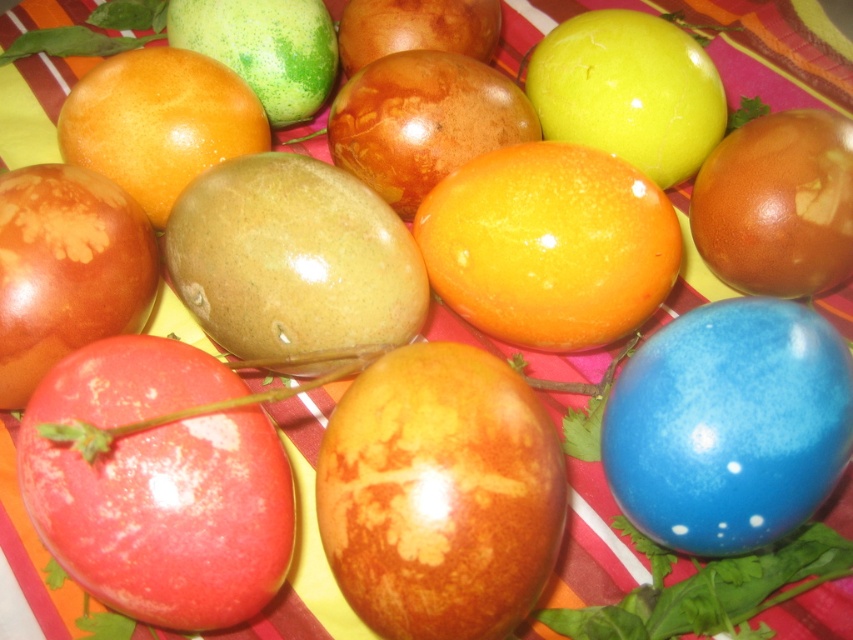
You are arranging a centerpiece for a party and need to place the brown marbled egg at center and the blue glossy egg at lower right. Based on their positions, which egg would be more visible to guests sitting at the table?

The brown marbled egg at center would be more visible to guests sitting at the table because it is positioned in front of the blue glossy egg at lower right, making it closer to the guests.

You are an artist trying to sketch the arrangement of eggs on the tablecloth. You want to place the brown marbled egg at center in your drawing. What are the exact coordinates where you should position it?

The brown marbled egg at center should be placed at coordinates 0.773 on the x axis and 0.517 on the y axis.

You are standing in front of the table with the colorful eggs. There are two points marked on the tablecloth. Which point is closer to you, point [508,426] or point [747,358]?

Point [508,426] is closer to you than point [747,358].